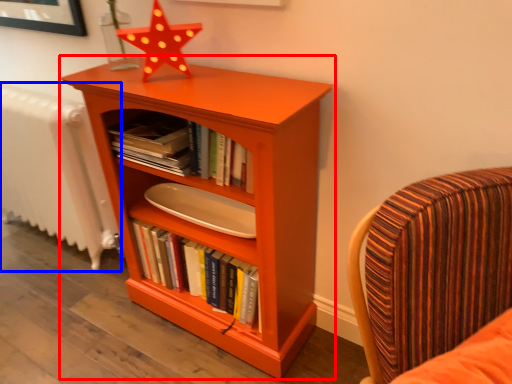
Question: Which point is closer to the camera, bookcase (highlighted by a red box) or radiator (highlighted by a blue box)?

Choices:
 (A) bookcase
 (B) radiator

Answer: (A)